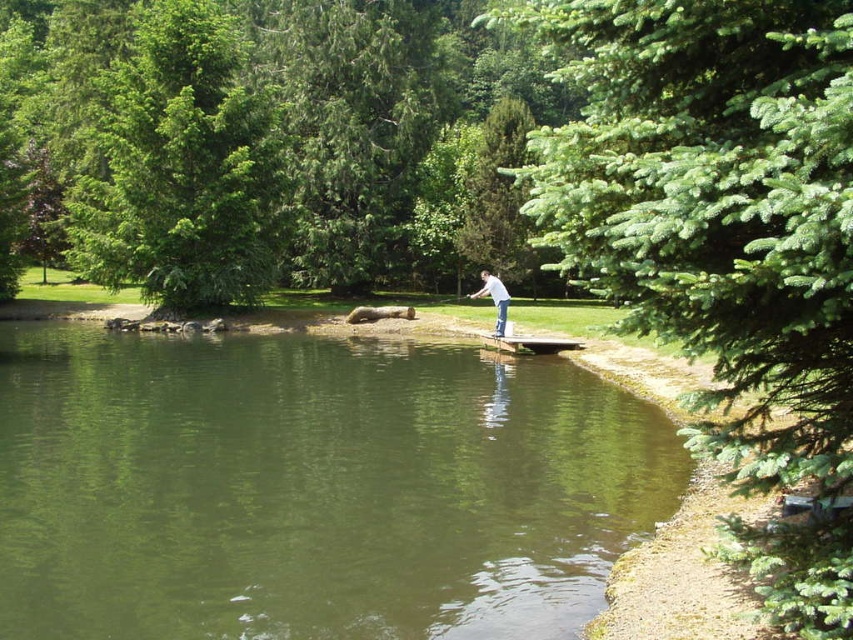
In the scene shown: You are a photographer trying to capture the reflection of the white matte shirt at center in the green water at center. Based on their heights, will the reflection be visible in the water?

The green water at center is shorter than the white matte shirt at center, so the reflection of the white matte shirt at center may not be fully visible in the water since the shirt is taller than the water surface.